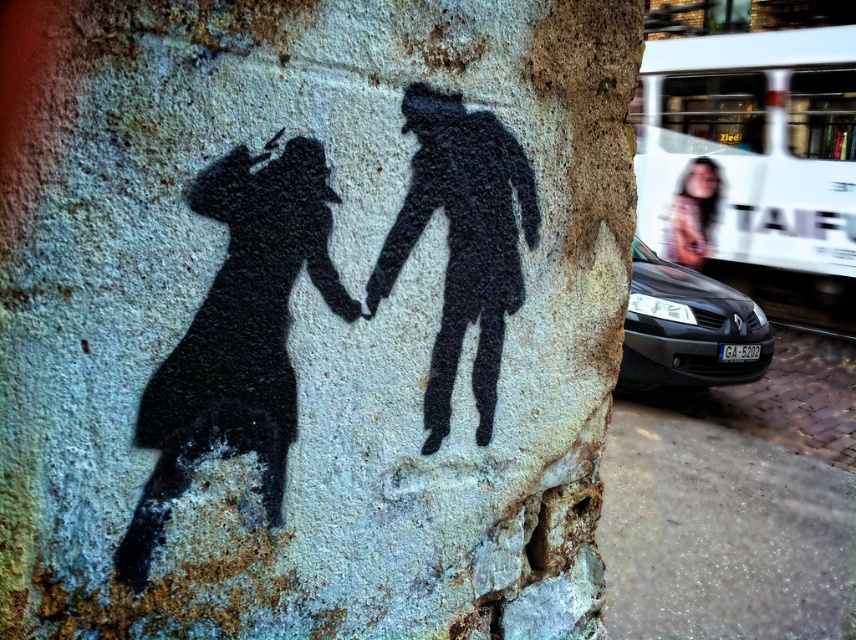
You are standing in front of a wall with a black silhouette of two figures holding hands. There is a black matte car at lower right. If you want to take a photo of the wall without the car in the frame, how far back should you step?

The black matte car at lower right is 6.00 meters away from the viewer. To ensure the car is out of the frame, you should step back until the car is no longer visible in your camera lens, which would require moving beyond 6.00 meters away from the wall.

You are a pedestrian standing on the sidewalk and see the black matte car at lower right and the smooth skin face at upper right in the image. Which object is closer to you?

The black matte car at lower right is closer to you since it is in front of the smooth skin face at upper right.